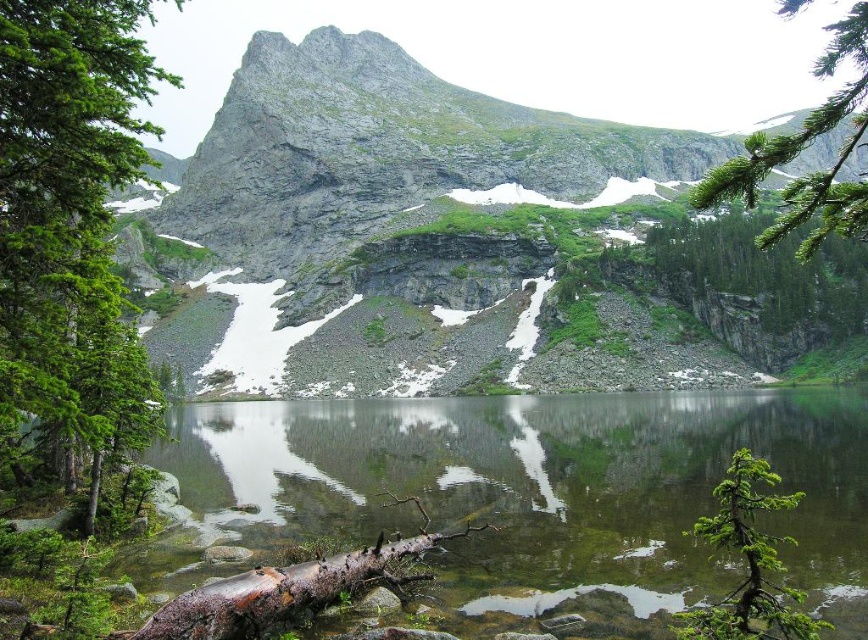
You are a hiker planning to cross the lake using the rusty wood log at lower center and the green matte tree at lower right as markers. Which object is wider when viewed from above?

The rusty wood log at lower center is wider than the green matte tree at lower right.